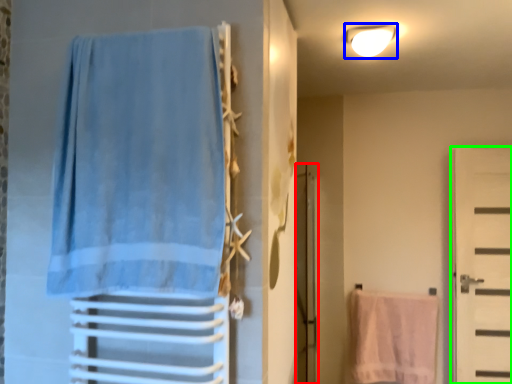
Question: Based on their relative distances, which object is farther from screen door (highlighted by a red box)? Choose from light fixture (highlighted by a blue box) and door (highlighted by a green box).

Choices:
 (A) light fixture
 (B) door

Answer: (B)